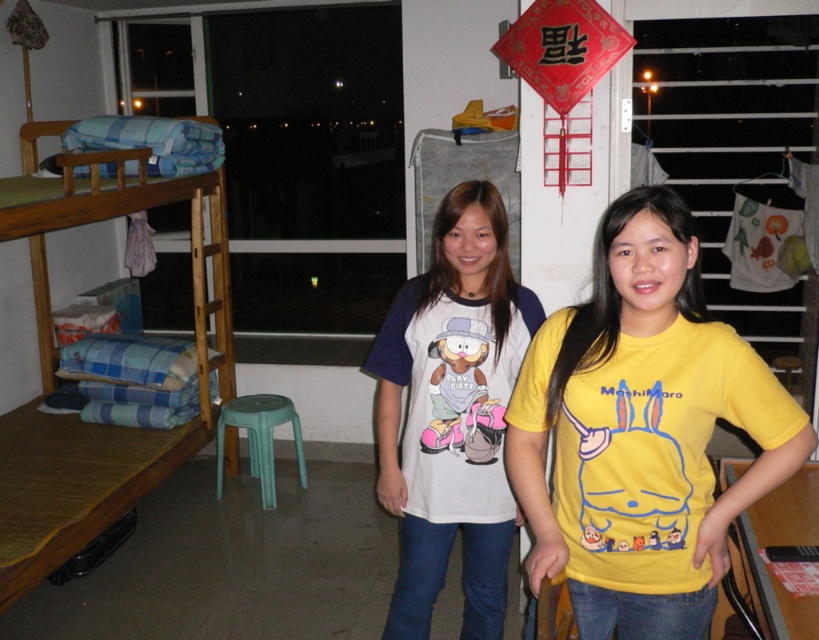
Question: Is yellow cotton t-shirt at center to the right of green plastic stool at center from the viewer's perspective?

Choices:
 (A) yes
 (B) no

Answer: (A)

Question: Which point appears closest to the camera in this image?

Choices:
 (A) (75, 524)
 (B) (269, 429)

Answer: (A)

Question: Which point is closer to the camera?

Choices:
 (A) white cotton t-shirt at center
 (B) wooden bunk bed at left

Answer: (A)

Question: Which object is closer to the camera taking this photo?

Choices:
 (A) white cotton t-shirt at center
 (B) yellow cotton t-shirt at center
 (C) green plastic stool at center

Answer: (B)

Question: Can you confirm if yellow cotton t-shirt at center is positioned to the right of white cotton t-shirt at center?

Choices:
 (A) no
 (B) yes

Answer: (B)

Question: Is yellow cotton t-shirt at center positioned before wooden bunk bed at left?

Choices:
 (A) no
 (B) yes

Answer: (B)